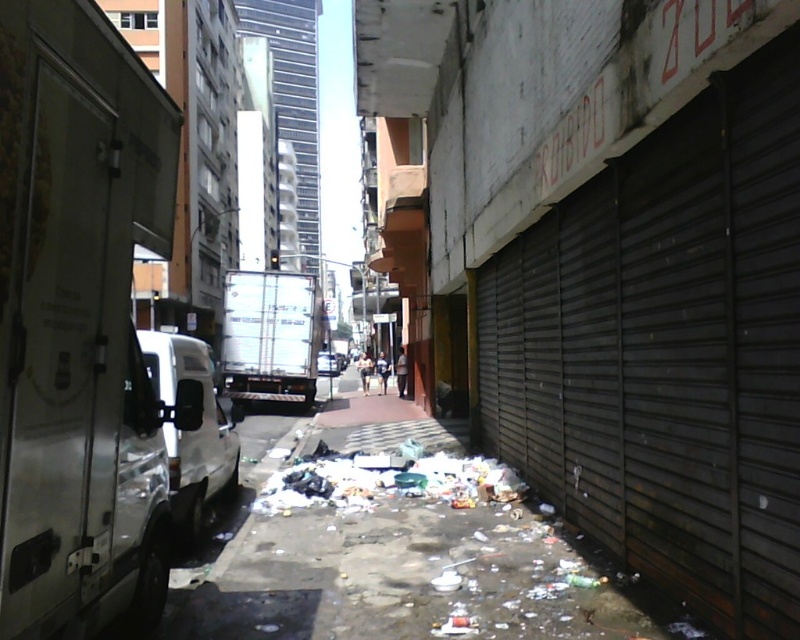
Question: Can you confirm if white metallic van at left is bigger than dirty concrete pavement at center?

Choices:
 (A) yes
 (B) no

Answer: (B)

Question: Which object appears closest to the camera in this image?

Choices:
 (A) white matte van at center
 (B) trashy plastic bags at center
 (C) dirty concrete pavement at center

Answer: (C)

Question: Does white metallic van at left appear under trashy plastic bags at center?

Choices:
 (A) no
 (B) yes

Answer: (A)

Question: Can you confirm if white metallic van at left is positioned to the right of trashy plastic bags at center?

Choices:
 (A) no
 (B) yes

Answer: (A)

Question: Based on their relative distances, which object is farther from the trashy plastic bags at center?

Choices:
 (A) white matte van at left
 (B) white metallic van at left
 (C) white matte van at center

Answer: (C)

Question: Estimate the real-world distances between objects in this image. Which object is farther from the white matte van at left?

Choices:
 (A) trashy plastic bags at center
 (B) white matte van at center
 (C) white metallic van at left
 (D) white metallic truck at center

Answer: (B)